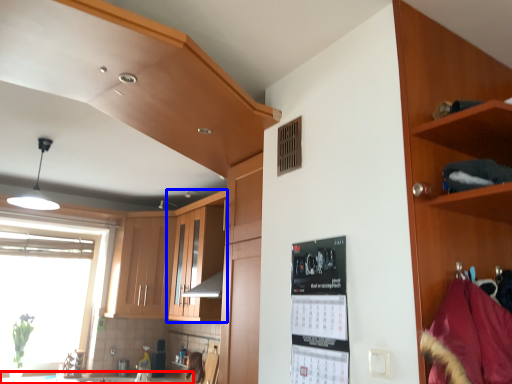
Question: Which object appears farthest to the camera in this image, counter top (highlighted by a red box) or cabinetry (highlighted by a blue box)?

Choices:
 (A) counter top
 (B) cabinetry

Answer: (B)